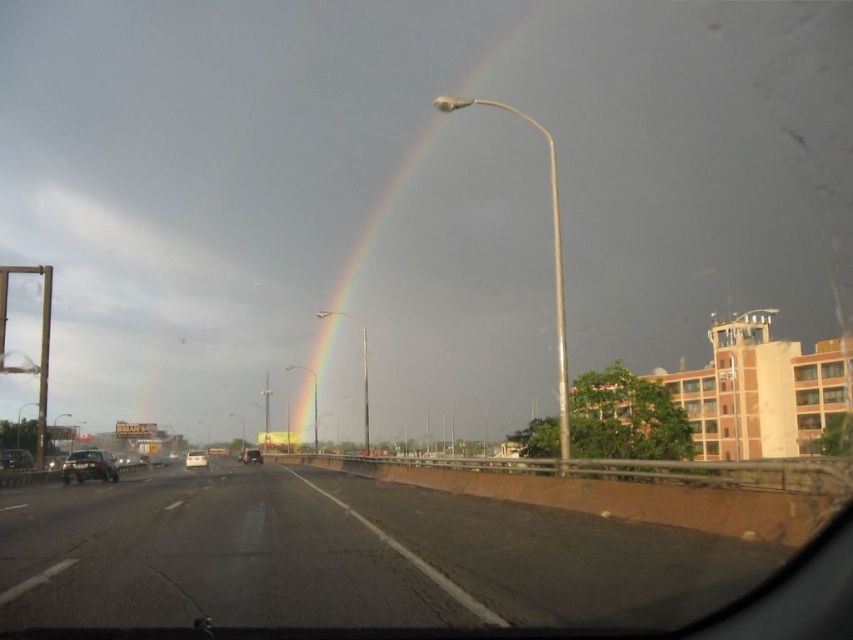
You are a passenger in the matte black car at left and want to exit the vehicle to take a photo of the rainbow. Considering the width of the road, can you safely open the door without hitting the silver metallic sedan at center?

The matte black car at left has a lesser width compared to the silver metallic sedan at center. Since the silver metallic sedan at center is wider, there might not be enough space between the two vehicles to safely open the door without risking contact. It would be safer to check the distance visually or use the mirrors before attempting to exit.

Based on the photo, you are a pedestrian standing at the edge of the asphalt road at center and want to cross to the matte black car at left. Is the road between you and the car closer or farther away compared to the car itself?

The asphalt road at center is closer to the viewer than the matte black car at left, so the road between you and the car is closer than the car itself.

You are a passenger in the shiny black sedan at left and want to see the rainbow in the sky. Can you see the rainbow over the silver metallic sedan at center?

The shiny black sedan at left has a lesser height compared to silver metallic sedan at center, so the silver metallic sedan at center would block your view of the rainbow in the sky.